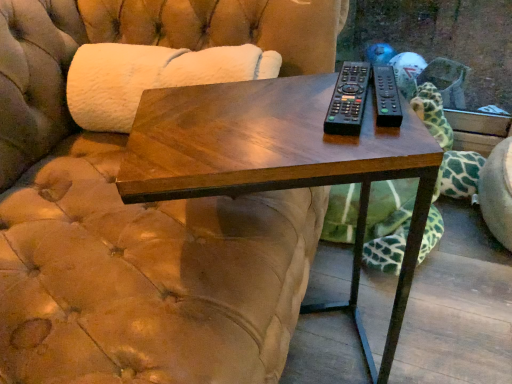
Measure the distance between black plastic remote at center, positioned as the 1th remote in right-to-left order, and camera.

black plastic remote at center, positioned as the 1th remote in right-to-left order, is 22.06 inches away from camera.

How much space does black plastic remote at center, acting as the second remote starting from the left, occupy horizontally?

black plastic remote at center, acting as the second remote starting from the left, is 6.41 inches in width.

Find the location of `green spotted fabric at right`. green spotted fabric at right is located at coordinates (389, 224).

This screenshot has width=512, height=384. In order to click on black plastic remote at center, the 2th remote positioned from the right in this screenshot , I will do `click(348, 100)`.

Considering the points (359, 105) and (390, 122), which point is in front, point (359, 105) or point (390, 122)?

The point (390, 122) is closer.

From a real-world perspective, which is physically below, black plastic remote at center, the 2th remote positioned from the right, or black plastic remote at center, positioned as the 1th remote in right-to-left order?

black plastic remote at center, the 2th remote positioned from the right.

What's the angular difference between black plastic remote at center, the 2th remote positioned from the right, and black plastic remote at center, acting as the second remote starting from the left,'s facing directions?

They differ by 7.26 degrees in their facing directions.

Based on their positions, is black plastic remote at center, the first remote when ordered from left to right, located to the left or right of black plastic remote at center, acting as the second remote starting from the left?

Clearly, black plastic remote at center, the first remote when ordered from left to right, is on the left of black plastic remote at center, acting as the second remote starting from the left, in the image.

Is dark wood table at center in contact with black plastic remote at center, positioned as the 1th remote in right-to-left order?

No, dark wood table at center is not in contact with black plastic remote at center, positioned as the 1th remote in right-to-left order.

From a real-world perspective, relative to black plastic remote at center, acting as the second remote starting from the left, is dark wood table at center vertically above or below?

dark wood table at center is below black plastic remote at center, acting as the second remote starting from the left.

Does dark wood table at center have a larger size compared to black plastic remote at center, acting as the second remote starting from the left?

Yes.

Which point is more distant from viewer, [389,131] or [380,99]?

The point [380,99] is more distant.

Does dark wood table at center turn towards green spotted fabric at right?

No, dark wood table at center is not turned towards green spotted fabric at right.

How different are the orientations of dark wood table at center and green spotted fabric at right in degrees?

The facing directions of dark wood table at center and green spotted fabric at right are 153 degrees apart.

Who is shorter, dark wood table at center or green spotted fabric at right?

green spotted fabric at right.

Would you say dark wood table at center is outside green spotted fabric at right?

Yes, dark wood table at center is outside of green spotted fabric at right.

Consider the image. From a real-world perspective, does black plastic remote at center, acting as the second remote starting from the left, sit lower than black plastic remote at center, the first remote when ordered from left to right?

No, from a real-world perspective, black plastic remote at center, acting as the second remote starting from the left, is not under black plastic remote at center, the first remote when ordered from left to right.

Considering the positions of point (375, 80) and point (342, 131), is point (375, 80) closer or farther from the camera than point (342, 131)?

Point (375, 80).

Considering their positions, is black plastic remote at center, positioned as the 1th remote in right-to-left order, located in front of or behind black plastic remote at center, the first remote when ordered from left to right?

In the image, black plastic remote at center, positioned as the 1th remote in right-to-left order, appears behind black plastic remote at center, the first remote when ordered from left to right.

In terms of width, does black plastic remote at center, the 2th remote positioned from the right, look wider or thinner when compared to dark wood table at center?

black plastic remote at center, the 2th remote positioned from the right, is thinner than dark wood table at center.

From the image's perspective, between black plastic remote at center, the first remote when ordered from left to right, and dark wood table at center, who is located below?

From the image's view, dark wood table at center is below.

Could dark wood table at center be considered to be inside black plastic remote at center, the first remote when ordered from left to right?

No, black plastic remote at center, the first remote when ordered from left to right, does not contain dark wood table at center.

Can you tell me how much black plastic remote at center, the 2th remote positioned from the right, and dark wood table at center differ in facing direction?

The angular difference between black plastic remote at center, the 2th remote positioned from the right, and dark wood table at center is 72.3 degrees.

Is black plastic remote at center, positioned as the 1th remote in right-to-left order, smaller than dark wood table at center?

Yes.

From the image's perspective, is black plastic remote at center, acting as the second remote starting from the left, on dark wood table at center?

Yes, from the image's perspective, black plastic remote at center, acting as the second remote starting from the left, is over dark wood table at center.

Is point (346, 103) behind point (472, 154)?

No.

Can you confirm if black plastic remote at center, the 2th remote positioned from the right, is positioned to the left of green spotted fabric at right?

Correct, you'll find black plastic remote at center, the 2th remote positioned from the right, to the left of green spotted fabric at right.

Considering the relative sizes of black plastic remote at center, the first remote when ordered from left to right, and green spotted fabric at right in the image provided, is black plastic remote at center, the first remote when ordered from left to right, smaller than green spotted fabric at right?

Yes, black plastic remote at center, the first remote when ordered from left to right, is smaller than green spotted fabric at right.

Could you tell me if black plastic remote at center, the 2th remote positioned from the right, is facing green spotted fabric at right?

No, black plastic remote at center, the 2th remote positioned from the right, is not facing towards green spotted fabric at right.

Image resolution: width=512 pixels, height=384 pixels. I want to click on remote that appears behind the black plastic remote at center, the first remote when ordered from left to right, so click(386, 97).

At what (x,y) coordinates should I click in order to perform the action: click on table that is on the left side of black plastic remote at center, acting as the second remote starting from the left. Please return your answer as a coordinate pair (x, y). Image resolution: width=512 pixels, height=384 pixels. Looking at the image, I should click on (279, 162).

Looking at the image, which one is located further to dark wood table at center, green spotted fabric at right or black plastic remote at center, the 2th remote positioned from the right?

green spotted fabric at right is further to dark wood table at center.

From the image, which object appears to be nearer to green spotted fabric at right, dark wood table at center or black plastic remote at center, the first remote when ordered from left to right?

dark wood table at center is closer to green spotted fabric at right.

From the image, which object appears to be farther from dark wood table at center, black plastic remote at center, positioned as the 1th remote in right-to-left order, or green spotted fabric at right?

green spotted fabric at right is further to dark wood table at center.

Which object lies further to the anchor point black plastic remote at center, the 2th remote positioned from the right, dark wood table at center or green spotted fabric at right?

green spotted fabric at right is further to black plastic remote at center, the 2th remote positioned from the right.

Which object lies further to the anchor point dark wood table at center, green spotted fabric at right or black plastic remote at center, acting as the second remote starting from the left?

green spotted fabric at right is further to dark wood table at center.

Estimate the real-world distances between objects in this image. Which object is further from black plastic remote at center, the 2th remote positioned from the right, green spotted fabric at right or dark wood table at center?

green spotted fabric at right is positioned further to the anchor black plastic remote at center, the 2th remote positioned from the right.

Which object lies nearer to the anchor point dark wood table at center, black plastic remote at center, positioned as the 1th remote in right-to-left order, or black plastic remote at center, the first remote when ordered from left to right?

Among the two, black plastic remote at center, the first remote when ordered from left to right, is located nearer to dark wood table at center.

When comparing their distances from green spotted fabric at right, does black plastic remote at center, the first remote when ordered from left to right, or dark wood table at center seem further?

black plastic remote at center, the first remote when ordered from left to right, is further to green spotted fabric at right.

Where is `remote between black plastic remote at center, the first remote when ordered from left to right, and green spotted fabric at right, along the z-axis`? remote between black plastic remote at center, the first remote when ordered from left to right, and green spotted fabric at right, along the z-axis is located at coordinates (386, 97).

At what (x,y) coordinates should I click in order to perform the action: click on remote between black plastic remote at center, acting as the second remote starting from the left, and dark wood table at center, in the vertical direction. Please return your answer as a coordinate pair (x, y). The width and height of the screenshot is (512, 384). Looking at the image, I should click on (348, 100).